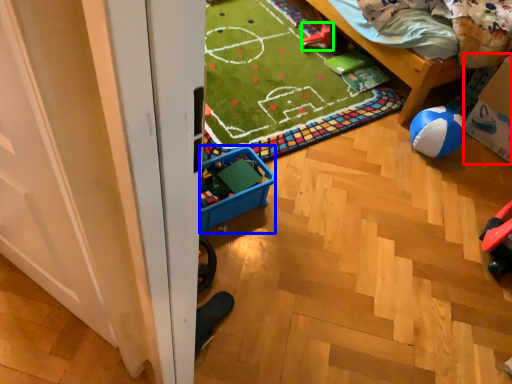
Question: Based on their relative distances, which object is nearer to cardboard box (highlighted by a red box)? Choose from storage box (highlighted by a blue box) and toy (highlighted by a green box).

Choices:
 (A) storage box
 (B) toy

Answer: (B)